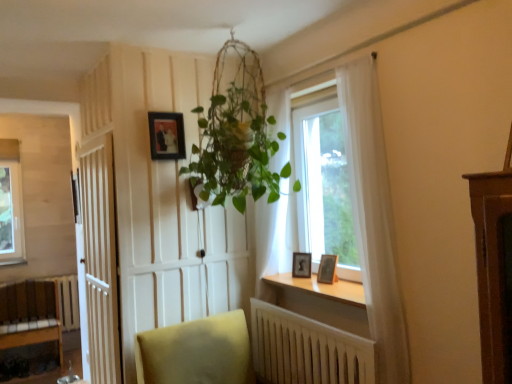
What is the approximate width of white wooden door at left?

white wooden door at left is 3.07 inches in width.

This screenshot has width=512, height=384. What do you see at coordinates (100, 259) in the screenshot?
I see `white wooden door at left` at bounding box center [100, 259].

What do you see at coordinates (327, 269) in the screenshot?
I see `wooden photo frame at window, marked as the third picture frame in a left-to-right arrangement` at bounding box center [327, 269].

At what (x,y) coordinates should I click in order to perform the action: click on matte black frame at upper center, the third picture frame in the bottom-to-top sequence. Please return your answer as a coordinate pair (x, y). This screenshot has height=384, width=512. Looking at the image, I should click on (166, 136).

The image size is (512, 384). I want to click on transparent glass window at center, so click(x=324, y=187).

Image resolution: width=512 pixels, height=384 pixels. What are the coordinates of `wooden at lower center` in the screenshot? It's located at (322, 288).

Locate an element on the screen. The width and height of the screenshot is (512, 384). white wooden door at left is located at coordinates (100, 259).

You are a GUI agent. You are given a task and a screenshot of the screen. Output one action in this format:
    pyautogui.click(x=<x>, y=<y>)
    Task: Click on the window on the right of the wooden radiator at lower center
    
    Given the screenshot: What is the action you would take?
    pyautogui.click(x=324, y=187)

Measure the distance from wooden radiator at lower center to transparent glass window at center.

wooden radiator at lower center and transparent glass window at center are 28.57 inches apart from each other.

Does wooden radiator at lower center lie behind transparent glass window at center?

No, wooden radiator at lower center is in front of transparent glass window at center.

Could transparent glass window at center be considered to be inside wooden radiator at lower center?

Actually, transparent glass window at center is outside wooden radiator at lower center.

Is transparent glass window at center with matte black frame at upper center, arranged as the first picture frame when viewed from the left?

No, transparent glass window at center is not with matte black frame at upper center, arranged as the first picture frame when viewed from the left.

From a real-world perspective, who is located higher, transparent glass window at center or matte black frame at upper center, the third picture frame in the bottom-to-top sequence?

matte black frame at upper center, the third picture frame in the bottom-to-top sequence, is physically above.

Looking at this image, does transparent glass window at center turn towards matte black frame at upper center, acting as the 3th picture frame starting from the right?

Yes, transparent glass window at center is oriented towards matte black frame at upper center, acting as the 3th picture frame starting from the right.

Between wooden bench at lower left and wooden radiator at lower center, which one has smaller width?

Thinner between the two is wooden radiator at lower center.

Is wooden bench at lower left in front of or behind wooden radiator at lower center in the image?

Clearly, wooden bench at lower left is behind wooden radiator at lower center.

Is wooden bench at lower left outside of wooden radiator at lower center?

wooden bench at lower left lies outside wooden radiator at lower center's area.

Is point (323, 383) behind point (293, 257)?

No, (323, 383) is in front of (293, 257).

Looking at this image, can wooden photo frame at window sill, which ranks as the 2th picture frame in right-to-left order, be found inside wooden radiator at lower center?

Actually, wooden photo frame at window sill, which ranks as the 2th picture frame in right-to-left order, is outside wooden radiator at lower center.

In the scene shown: Considering the positions of objects wooden radiator at lower center and wooden photo frame at window sill, which appears as the 1th picture frame when ordered from the bottom, in the image provided, who is more to the right, wooden radiator at lower center or wooden photo frame at window sill, which appears as the 1th picture frame when ordered from the bottom,?

wooden photo frame at window sill, which appears as the 1th picture frame when ordered from the bottom, is more to the right.

Measure the distance from wooden radiator at lower center to wooden photo frame at window sill, which appears as the 1th picture frame when ordered from the bottom.

The distance of wooden radiator at lower center from wooden photo frame at window sill, which appears as the 1th picture frame when ordered from the bottom, is 49.87 centimeters.

From a real-world perspective, between matte black frame at upper center, the first picture frame viewed from the top, and wooden photo frame at window, the second picture frame positioned from the top, who is vertically higher?

matte black frame at upper center, the first picture frame viewed from the top.

Visually, is matte black frame at upper center, the first picture frame viewed from the top, positioned to the left or to the right of wooden photo frame at window, the second picture frame positioned from the bottom?

Clearly, matte black frame at upper center, the first picture frame viewed from the top, is on the left of wooden photo frame at window, the second picture frame positioned from the bottom, in the image.

Can we say matte black frame at upper center, acting as the 3th picture frame starting from the right, lies outside wooden photo frame at window, the second picture frame positioned from the top?

That's correct, matte black frame at upper center, acting as the 3th picture frame starting from the right, is outside of wooden photo frame at window, the second picture frame positioned from the top.

From the image's perspective, which is below, matte black frame at upper center, arranged as the first picture frame when viewed from the left, or wooden photo frame at window, the second picture frame positioned from the bottom?

From the image's view, wooden photo frame at window, the second picture frame positioned from the bottom, is below.

From the image's perspective, is matte black frame at upper center, acting as the 3th picture frame starting from the right, located above wooden photo frame at window sill, the 3th picture frame positioned from the top?

Yes, from the image's perspective, matte black frame at upper center, acting as the 3th picture frame starting from the right, is on top of wooden photo frame at window sill, the 3th picture frame positioned from the top.

Is matte black frame at upper center, acting as the 3th picture frame starting from the right, positioned beyond the bounds of wooden photo frame at window sill, which ranks as the 2th picture frame in right-to-left order?

matte black frame at upper center, acting as the 3th picture frame starting from the right, lies outside wooden photo frame at window sill, which ranks as the 2th picture frame in right-to-left order,'s area.

Does wooden bench at lower left lie in front of white wooden door at left?

No.

Which of these two, wooden bench at lower left or white wooden door at left, is bigger?

Bigger between the two is wooden bench at lower left.

Could you tell me if wooden bench at lower left is turned towards white wooden door at left?

Yes, wooden bench at lower left is aimed at white wooden door at left.

Where is `window that is on the right side of wooden radiator at lower center`? window that is on the right side of wooden radiator at lower center is located at coordinates tap(324, 187).

Locate an element on the screen. This screenshot has width=512, height=384. picture frame that is the 2nd one when counting backward from the transparent glass window at center is located at coordinates (166, 136).

Based on their spatial positions, is wooden bench at lower left or transparent glass window at center closer to white wooden door at left?

transparent glass window at center is closer to white wooden door at left.

From the image, which object appears to be nearer to wooden bench at lower left, matte black frame at upper center, the third picture frame in the bottom-to-top sequence, or transparent glass window at center?

Among the two, matte black frame at upper center, the third picture frame in the bottom-to-top sequence, is located nearer to wooden bench at lower left.

From the image, which object appears to be nearer to white wooden door at left, transparent glass window at center or wooden at lower center?

Among the two, wooden at lower center is located nearer to white wooden door at left.

Based on the photo, when comparing their distances from white wooden door at left, does wooden photo frame at window sill, the second picture frame viewed from the left, or wooden bench at lower left seem closer?

wooden photo frame at window sill, the second picture frame viewed from the left.

From the image, which object appears to be nearer to wooden bench at lower left, wooden photo frame at window sill, the 3th picture frame positioned from the top, or wooden at lower center?

The object closer to wooden bench at lower left is wooden at lower center.

Considering their positions, is matte black frame at upper center, arranged as the first picture frame when viewed from the left, positioned further to wooden radiator at lower center than wooden photo frame at window sill, which appears as the 1th picture frame when ordered from the bottom?

matte black frame at upper center, arranged as the first picture frame when viewed from the left, is positioned further to the anchor wooden radiator at lower center.

Estimate the real-world distances between objects in this image. Which object is closer to white wooden door at left, transparent glass window at center or matte black frame at upper center, arranged as the first picture frame when viewed from the left?

matte black frame at upper center, arranged as the first picture frame when viewed from the left, is closer to white wooden door at left.

From the image, which object appears to be farther from transparent glass window at center, wooden photo frame at window, the second picture frame positioned from the top, or white wooden door at left?

Among the two, white wooden door at left is located further to transparent glass window at center.

At what (x,y) coordinates should I click in order to perform the action: click on door located between wooden bench at lower left and matte black frame at upper center, the first picture frame viewed from the top, in the left-right direction. Please return your answer as a coordinate pair (x, y). Looking at the image, I should click on (100, 259).

Locate an element on the screen. The image size is (512, 384). radiator located between white wooden door at left and wooden at lower center in the left-right direction is located at coordinates (307, 349).

This screenshot has height=384, width=512. I want to click on window sill between matte black frame at upper center, acting as the 3th picture frame starting from the right, and wooden radiator at lower center in the up-down direction, so click(x=322, y=288).

Identify the location of radiator between white wooden door at left and wooden photo frame at window sill, the 3th picture frame positioned from the top. (307, 349).